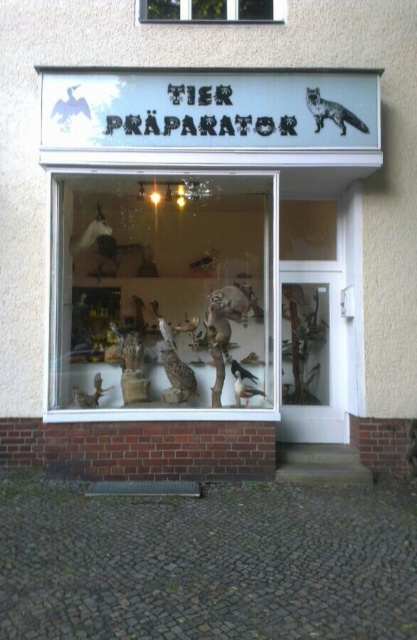
Question: Estimate the real-world distances between objects in this image. Which object is closer to the transparent glass window at upper center?

Choices:
 (A) fuzzy brown raccoon at center
 (B) gray fur fox at upper right
 (C) matte plastic animal figures at center
 (D) wooden display case at center

Answer: (B)

Question: Which of these objects is positioned farthest from the gray fur fox at upper right?

Choices:
 (A) matte brown owl at center
 (B) wooden display case at center
 (C) matte plastic animal figures at center

Answer: (A)

Question: Is transparent glass window at upper center positioned at the back of gray fur fox at upper right?

Choices:
 (A) no
 (B) yes

Answer: (B)

Question: Does fuzzy brown raccoon at center appear on the right side of matte brown owl at center?

Choices:
 (A) no
 (B) yes

Answer: (B)

Question: Which is nearer to the matte brown owl at center?

Choices:
 (A) transparent glass window at upper center
 (B) fuzzy brown raccoon at center
 (C) gray fur fox at upper right
 (D) matte plastic animal figures at center

Answer: (B)

Question: Can you confirm if transparent glass window at upper center is positioned above gray fur fox at upper right?

Choices:
 (A) yes
 (B) no

Answer: (A)